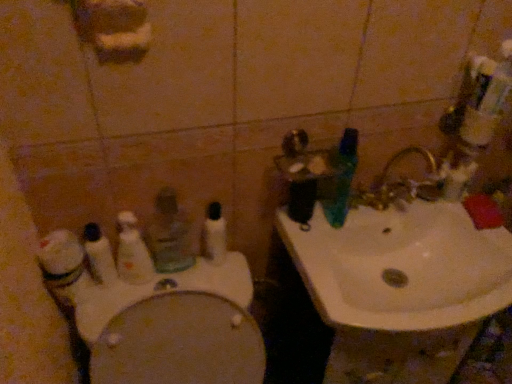
Question: From a real-world perspective, does white ceramic sink at upper right stand above white plastic toothbrush at center, which is the third toothbrush from left to right?

Choices:
 (A) no
 (B) yes

Answer: (A)

Question: Considering the relative sizes of white ceramic sink at upper right and white plastic toothbrush at center, the second toothbrush in the right-to-left sequence, in the image provided, is white ceramic sink at upper right thinner than white plastic toothbrush at center, the second toothbrush in the right-to-left sequence,?

Choices:
 (A) yes
 (B) no

Answer: (B)

Question: Considering the relative sizes of white ceramic sink at upper right and white plastic toothbrush at center, which is the third toothbrush from left to right, in the image provided, is white ceramic sink at upper right shorter than white plastic toothbrush at center, which is the third toothbrush from left to right,?

Choices:
 (A) yes
 (B) no

Answer: (A)

Question: Is the depth of white ceramic sink at upper right less than that of white plastic toothbrush at center, the second toothbrush in the right-to-left sequence?

Choices:
 (A) no
 (B) yes

Answer: (B)

Question: Can you confirm if white ceramic sink at upper right is wider than white plastic toothbrush at center, the second toothbrush in the right-to-left sequence?

Choices:
 (A) no
 (B) yes

Answer: (B)

Question: Would you say white ceramic sink at upper right is outside white plastic toothbrush at center, the second toothbrush in the right-to-left sequence?

Choices:
 (A) yes
 (B) no

Answer: (A)

Question: From a real-world perspective, does white plastic toothbrush at left, which is the first toothbrush in left-to-right order, sit lower than green plastic toothbrush at upper right, the 1th toothbrush when ordered from right to left?

Choices:
 (A) yes
 (B) no

Answer: (A)

Question: Is white plastic toothbrush at left, which is the first toothbrush in left-to-right order, turned away from green plastic toothbrush at upper right, which ranks as the 4th toothbrush in left-to-right order?

Choices:
 (A) no
 (B) yes

Answer: (A)

Question: Is white plastic toothbrush at left, which is the first toothbrush in left-to-right order, taller than green plastic toothbrush at upper right, the 1th toothbrush when ordered from right to left?

Choices:
 (A) no
 (B) yes

Answer: (A)

Question: Is white plastic toothbrush at left, which appears as the fourth toothbrush when viewed from the right, oriented towards green plastic toothbrush at upper right, which ranks as the 4th toothbrush in left-to-right order?

Choices:
 (A) yes
 (B) no

Answer: (B)

Question: Considering the relative sizes of white plastic toothbrush at left, which is the first toothbrush in left-to-right order, and green plastic toothbrush at upper right, the 1th toothbrush when ordered from right to left, in the image provided, is white plastic toothbrush at left, which is the first toothbrush in left-to-right order, bigger than green plastic toothbrush at upper right, the 1th toothbrush when ordered from right to left,?

Choices:
 (A) yes
 (B) no

Answer: (B)

Question: Can you confirm if white plastic toothbrush at left, which appears as the fourth toothbrush when viewed from the right, is positioned to the right of green plastic toothbrush at upper right, the 1th toothbrush when ordered from right to left?

Choices:
 (A) yes
 (B) no

Answer: (B)

Question: From the image's perspective, is white plastic toothbrush at left, which is the first toothbrush in left-to-right order, over white glossy toilet at lower left?

Choices:
 (A) no
 (B) yes

Answer: (B)